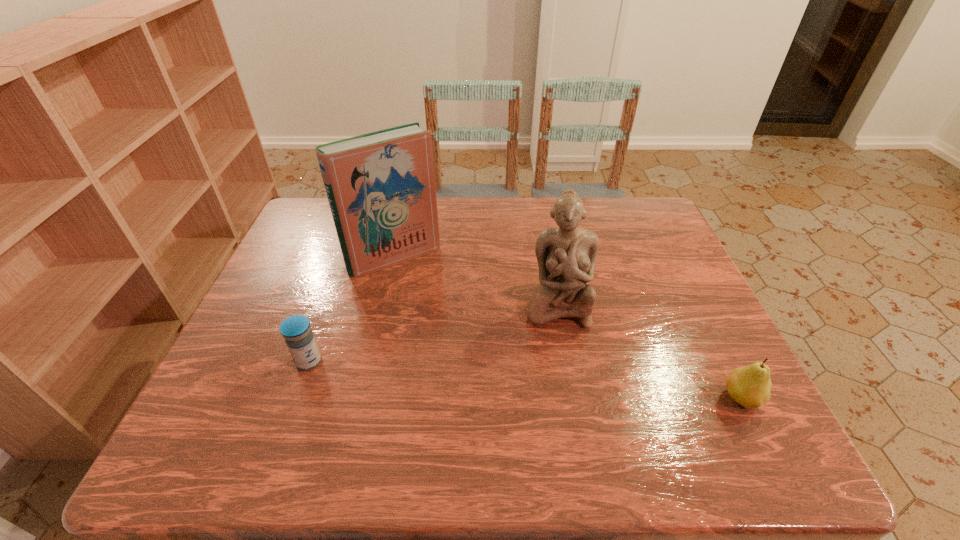
Locate an element on the screen. This screenshot has height=540, width=960. vacant space in between the farthest object and the figurine is located at coordinates (476, 281).

The image size is (960, 540). In order to click on unoccupied position between the tallest object and the nearest object in this screenshot , I will do `click(568, 328)`.

In order to click on vacant space that is in between the hardback book and the third nearest object in this screenshot , I will do `click(476, 281)`.

Image resolution: width=960 pixels, height=540 pixels. Identify the location of free spot between the rightmost object and the farthest object. (568, 328).

Image resolution: width=960 pixels, height=540 pixels. Find the location of `empty location between the figurine and the rightmost object`. empty location between the figurine and the rightmost object is located at coordinates (649, 352).

Locate an element on the screen. The height and width of the screenshot is (540, 960). the closest object to the nearest object is located at coordinates (566, 255).

Locate an element on the screen. The image size is (960, 540). the closest object relative to the tallest object is located at coordinates (566, 255).

You are a GUI agent. You are given a task and a screenshot of the screen. Output one action in this format:
    pyautogui.click(x=<x>, y=<y>)
    Task: Click on the free space that satisfies the following two spatial constraints: 1. on the front side of the third farthest object; 2. on the left side of the pear
    The height and width of the screenshot is (540, 960).
    Given the screenshot: What is the action you would take?
    pyautogui.click(x=296, y=399)

Locate an element on the screen. This screenshot has width=960, height=540. free point that satisfies the following two spatial constraints: 1. on the front side of the second object from right to left; 2. on the right side of the rightmost object is located at coordinates (574, 399).

This screenshot has width=960, height=540. I want to click on free space that satisfies the following two spatial constraints: 1. on the front side of the pear; 2. on the right side of the third object from left to right, so click(x=574, y=399).